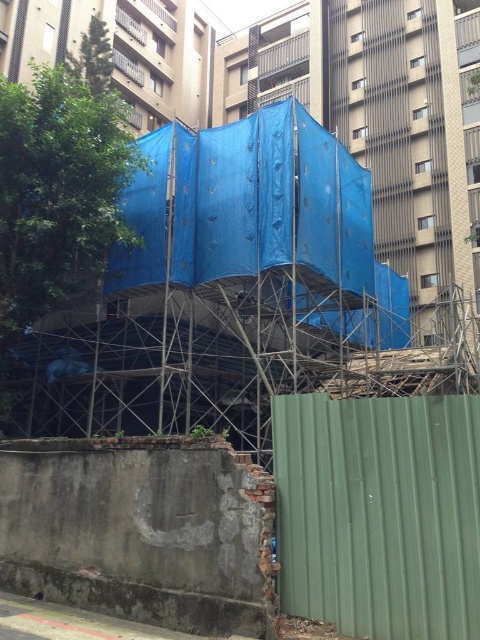
Is the position of green corrugated metal fence at lower right less distant than that of metallic scaffolding at center?

Yes, it is in front of metallic scaffolding at center.

Can you confirm if green corrugated metal fence at lower right is wider than metallic scaffolding at center?

Correct, the width of green corrugated metal fence at lower right exceeds that of metallic scaffolding at center.

Which is behind, point (457, 484) or point (81, 374)?

The point (81, 374) is more distant.

At what (x,y) coordinates should I click in order to perform the action: click on green corrugated metal fence at lower right. Please return your answer as a coordinate pair (x, y). The height and width of the screenshot is (640, 480). Looking at the image, I should click on (380, 513).